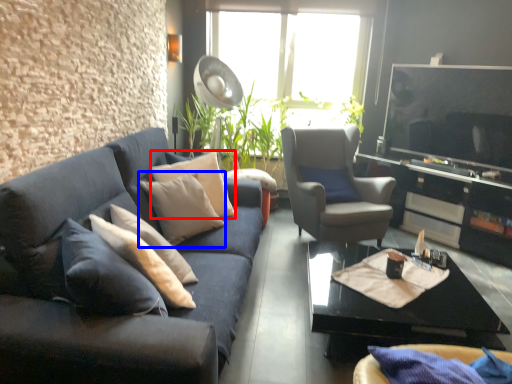
Question: Which of the following is the farthest to the observer, pillow (highlighted by a red box) or pillow (highlighted by a blue box)?

Choices:
 (A) pillow
 (B) pillow

Answer: (A)